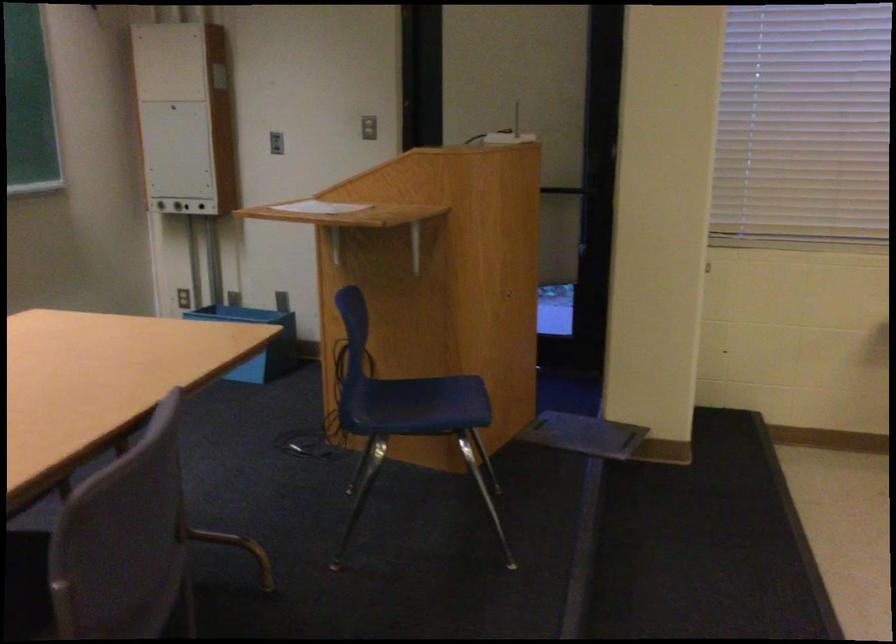
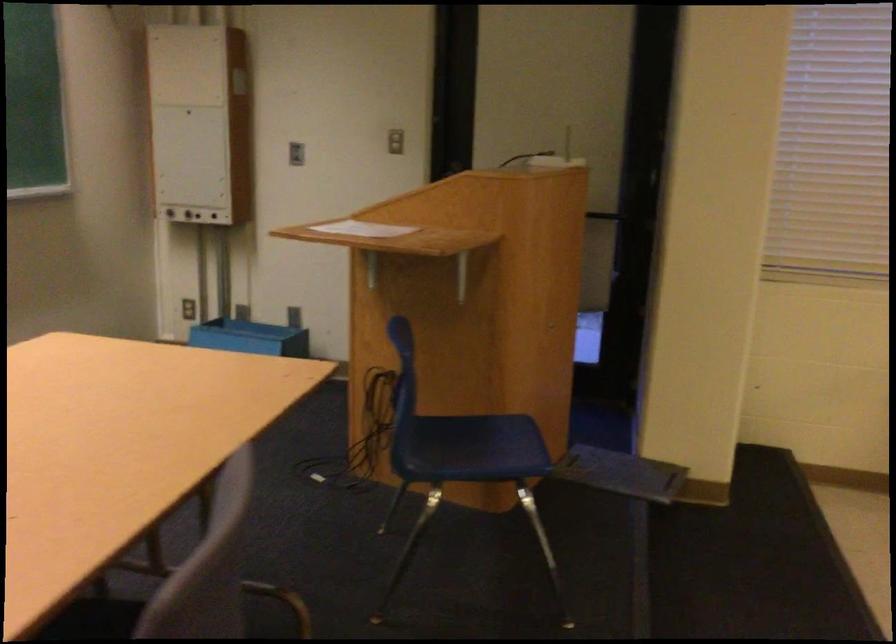
Question: How did the camera likely rotate?

Choices:
 (A) Left
 (B) Right
 (C) Up
 (D) Down

Answer: (B)